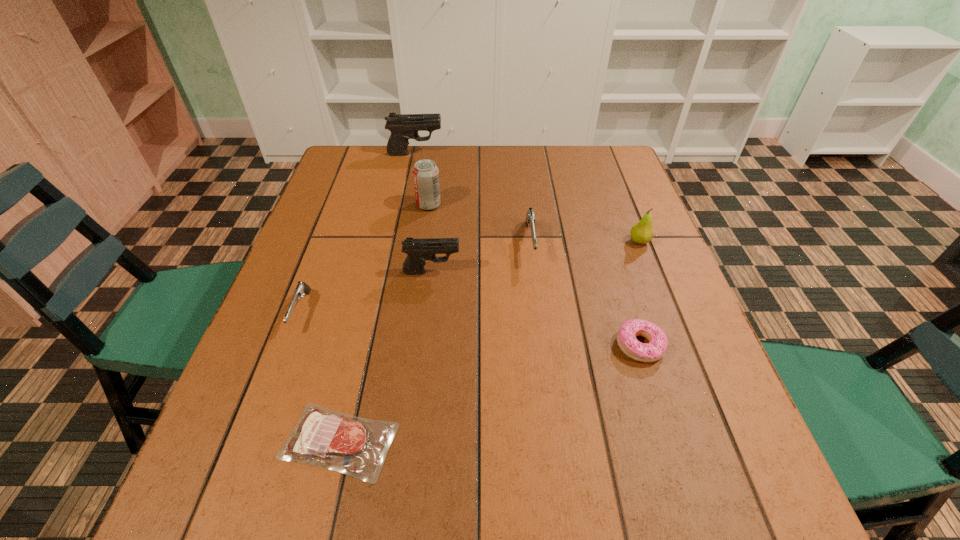
Where is `the shortest pistol`? the shortest pistol is located at coordinates (301, 288).

In order to click on the seventh tallest object in this screenshot , I will do `click(626, 337)`.

Locate an element on the screen. The image size is (960, 540). doughnut is located at coordinates (626, 337).

Find the location of a particular element. Image resolution: width=960 pixels, height=540 pixels. the nearest object is located at coordinates (355, 446).

Locate an element on the screen. The image size is (960, 540). the shortest object is located at coordinates (355, 446).

In order to click on free space located at the barrel of the farther black pistol in this screenshot , I will do `click(536, 154)`.

I want to click on vacant region located 0.280m on the right of the gray soda can, so click(x=541, y=205).

The width and height of the screenshot is (960, 540). What are the coordinates of `free region located 0.290m on the front of the rightmost object` in the screenshot? It's located at (679, 343).

This screenshot has height=540, width=960. What are the coordinates of `vacant position located 0.140m at the barrel of the nearer black pistol` in the screenshot? It's located at (519, 272).

Locate an element on the screen. vacant region located on the front-facing side of the rightmost pistol is located at coordinates (540, 327).